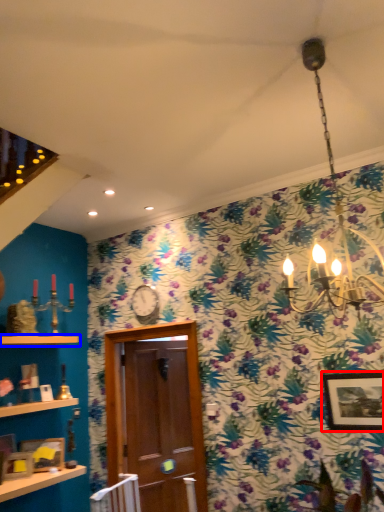
Question: Among these objects, which one is nearest to the camera, picture frame (highlighted by a red box) or shelf (highlighted by a blue box)?

Choices:
 (A) picture frame
 (B) shelf

Answer: (A)